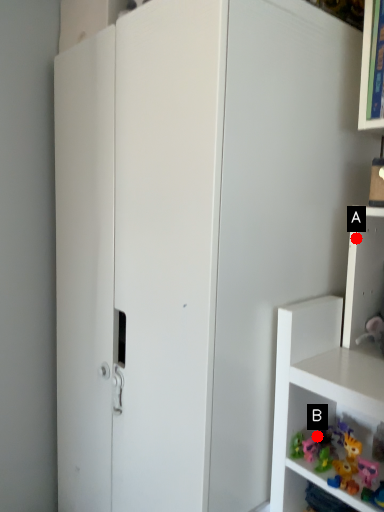
Question: Two points are circled on the image, labeled by A and B beside each circle. Which point is closer to the camera?

Choices:
 (A) A is closer
 (B) B is closer

Answer: (B)